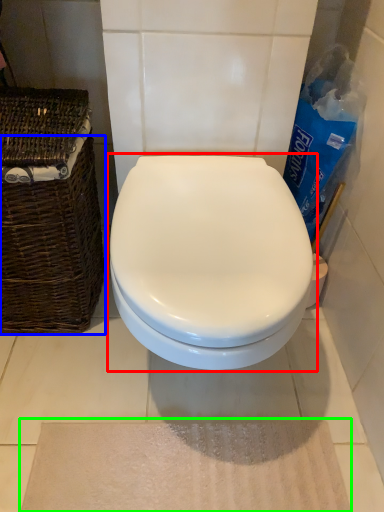
Question: Which object is positioned farthest from toilet (highlighted by a red box)? Select from basket (highlighted by a blue box) and bath mat (highlighted by a green box).

Choices:
 (A) basket
 (B) bath mat

Answer: (B)